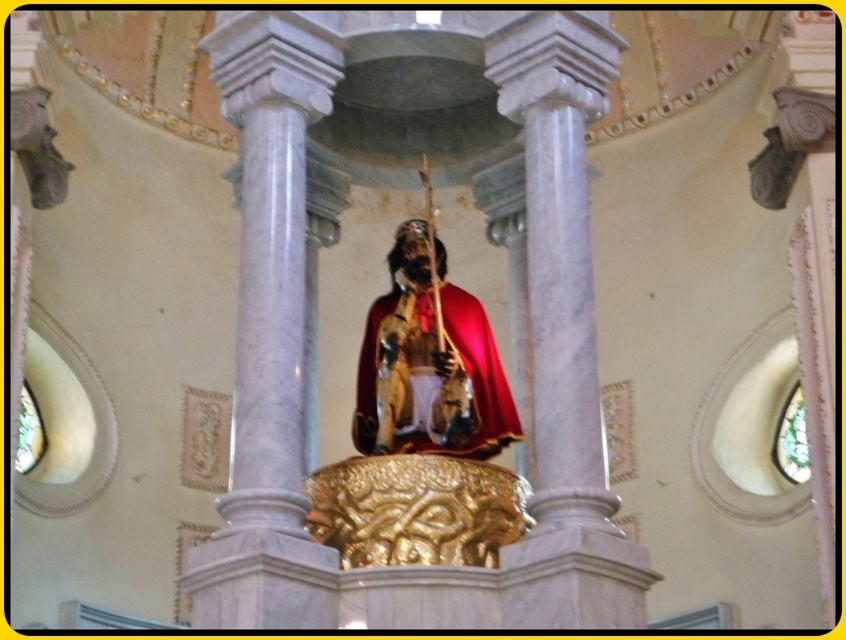
Question: Which point is farther to the camera?

Choices:
 (A) (396, 428)
 (B) (356, 404)

Answer: (B)

Question: Is gold polished statue at center further to the viewer compared to shiny gold robe at center?

Choices:
 (A) no
 (B) yes

Answer: (A)

Question: Which object appears farthest from the camera in this image?

Choices:
 (A) shiny gold robe at center
 (B) gold polished statue at center

Answer: (A)

Question: Which object is closer to the camera taking this photo?

Choices:
 (A) shiny gold robe at center
 (B) gold polished statue at center

Answer: (B)

Question: Can you confirm if gold polished statue at center is positioned above shiny gold robe at center?

Choices:
 (A) no
 (B) yes

Answer: (B)

Question: Can you confirm if gold polished statue at center is positioned below shiny gold robe at center?

Choices:
 (A) yes
 (B) no

Answer: (B)